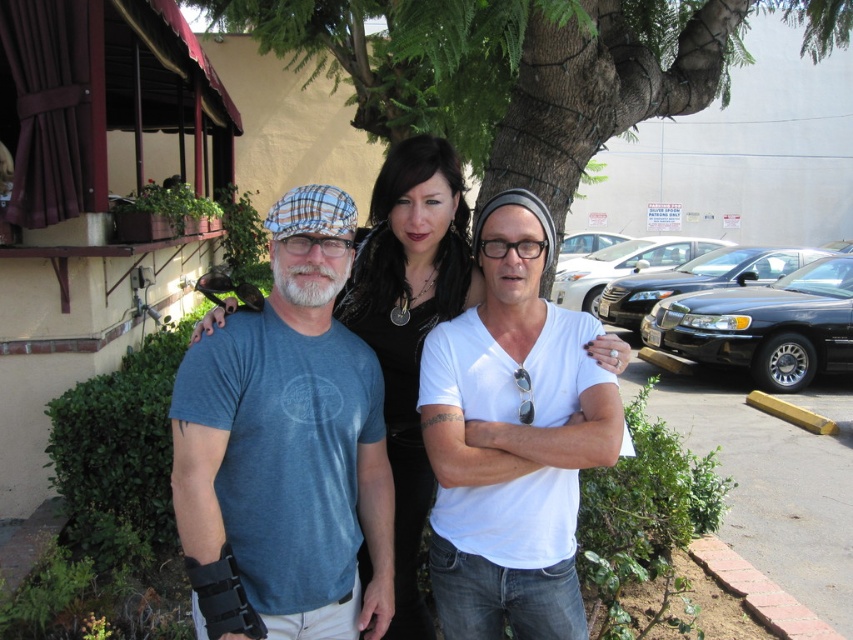
Please describe the location of the point marked at coordinates (523, 68) in the image. Which object does it belong to?

The point at coordinates (523, 68) is located on the green leafy tree at center.

You are a photographer trying to decide which eyewear to choose for a photo shoot. You have the matte plaid goggles at center and the transparent plastic glasses at center. Based on their height, which one might be more suitable for a closeup portrait to avoid blocking the subject face?

The transparent plastic glasses at center are taller than the matte plaid goggles at center. Since the matte plaid goggles at center are shorter, they might be less likely to block the subject face in a closeup portrait.